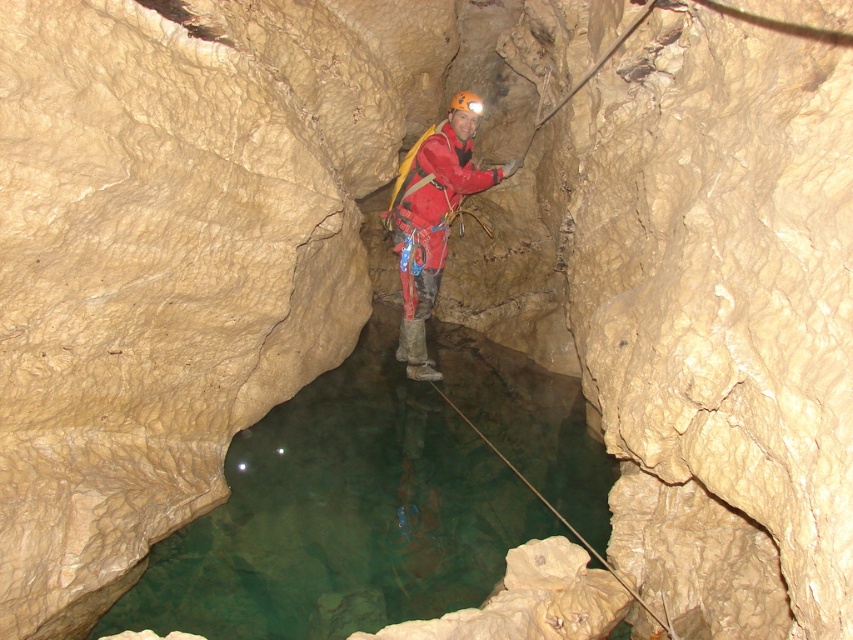
Based on the photo, who is shorter, clear water at center or red matte jacket at center?

clear water at center is shorter.

Which is behind, point (413, 451) or point (402, 346)?

Point (402, 346)

Where is `clear water at center`? The image size is (853, 640). clear water at center is located at coordinates (341, 515).